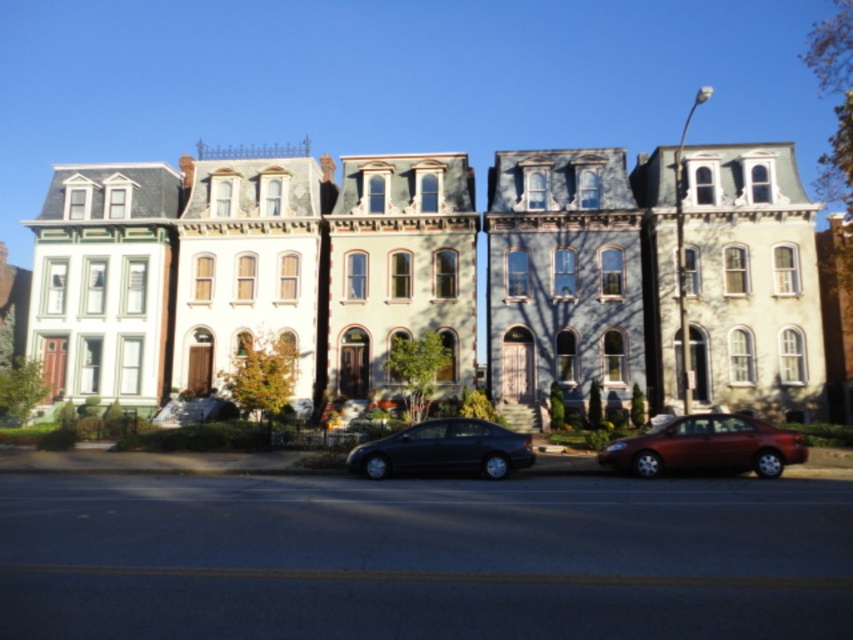
You are a delivery driver who needs to park your vehicle between the shiny red sedan at lower right and the satin black sedan at center. Is there enough space for your van, which is 2 meters wide?

The shiny red sedan at lower right is to the right of the satin black sedan at center. The distance between them is not specified, so it is impossible to determine if there is enough space for the van.

You are a delivery person trying to park your van between the shiny red sedan at lower right and the satin black sedan at center. Is there enough space between them for your van?

The shiny red sedan at lower right is bigger than the satin black sedan at center, but the exact distance between them isn not specified. Without knowing the distance, it is impossible to determine if there is enough space for the van.